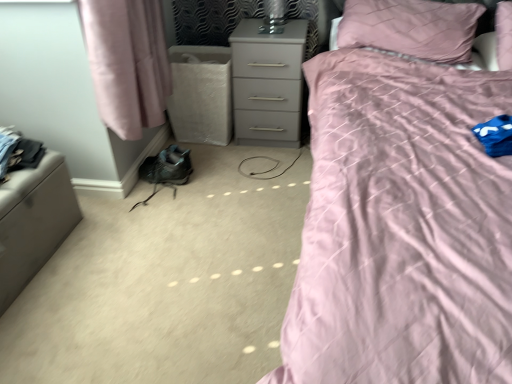
Question: Are pink quilted pillow at upper right and dark gray fabric at left beside each other?

Choices:
 (A) no
 (B) yes

Answer: (A)

Question: Can you confirm if pink quilted pillow at upper right is positioned to the left of dark gray fabric at left?

Choices:
 (A) no
 (B) yes

Answer: (A)

Question: Can you confirm if pink quilted pillow at upper right is smaller than dark gray fabric at left?

Choices:
 (A) yes
 (B) no

Answer: (B)

Question: From a real-world perspective, is pink quilted pillow at upper right positioned over dark gray fabric at left based on gravity?

Choices:
 (A) no
 (B) yes

Answer: (B)

Question: Considering the relative sizes of pink quilted pillow at upper right and dark gray fabric at left in the image provided, is pink quilted pillow at upper right wider than dark gray fabric at left?

Choices:
 (A) no
 (B) yes

Answer: (B)

Question: Is pink quilted pillow at upper right aimed at dark gray fabric at left?

Choices:
 (A) yes
 (B) no

Answer: (B)

Question: Does matte pink quilt at upper right lie in front of pink quilted pillow at upper right?

Choices:
 (A) no
 (B) yes

Answer: (B)

Question: Can you confirm if matte pink quilt at upper right is smaller than pink quilted pillow at upper right?

Choices:
 (A) no
 (B) yes

Answer: (A)

Question: From the image's perspective, does matte pink quilt at upper right appear lower than pink quilted pillow at upper right?

Choices:
 (A) yes
 (B) no

Answer: (A)

Question: Is pink quilted pillow at upper right located within matte pink quilt at upper right?

Choices:
 (A) no
 (B) yes

Answer: (B)

Question: Is matte pink quilt at upper right directly adjacent to pink quilted pillow at upper right?

Choices:
 (A) yes
 (B) no

Answer: (B)

Question: Could you tell me if matte pink quilt at upper right is turned towards pink quilted pillow at upper right?

Choices:
 (A) yes
 (B) no

Answer: (B)

Question: From the image's perspective, does pink quilted pillow at upper right appear lower than matte pink quilt at upper right?

Choices:
 (A) yes
 (B) no

Answer: (B)